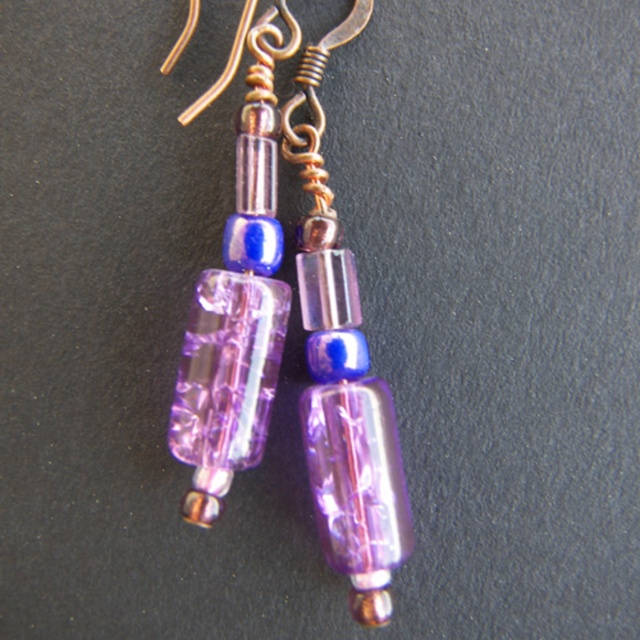
You are an earring designer examining the image. You need to place a new crystal bead between the transparent purple glass bead at center and the translucent purple glass bead at center. Based on their positions, where should you place the new bead?

The transparent purple glass bead at center is below the translucent purple glass bead at center, so you should place the new crystal bead between them by positioning it above the transparent one and below the translucent one.

You are an earring designer examining the earrings. You notice two purple glass beads at the center. Which one is closer to you, the transparent purple glass bead at center or the translucent purple glass bead at center?

The transparent purple glass bead at center is closer to you because the translucent purple glass bead at center is positioned behind it.

You are an appraiser holding a magnifying glass 0.5 meters away from your eyes. You want to examine the transparent purple glass bead at center closely. Can you bring the bead closer to your eyes than the magnifying glass?

The transparent purple glass bead at center is 1.28 meters away from the viewer. Since the magnifying glass is only 0.5 meters away from your eyes, you can move the bead closer to your eyes to within 0.5 meters, allowing it to be examined through the magnifying glass effectively.